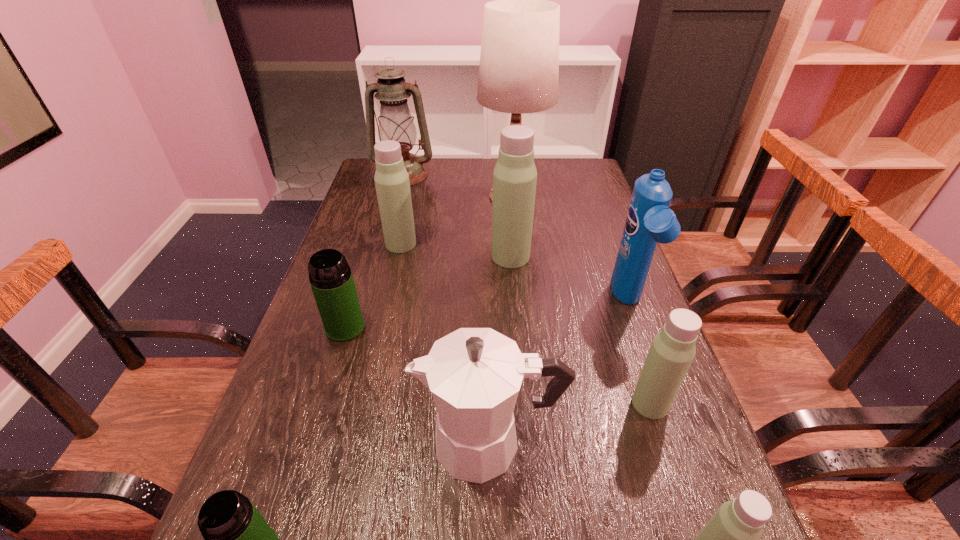
Identify the location of thermos bottle that can be found as the fifth closest to the tallest thermos bottle. (237, 539).

Select which thermos bottle is the second closest to the oil lamp. Please provide its 2D coordinates. Your answer should be formatted as a tuple, i.e. [(x, y)], where the tuple contains the x and y coordinates of a point satisfying the conditions above.

[(515, 176)]

Locate an element on the screen. The width and height of the screenshot is (960, 540). light thermos bottle that is the second closest to the shampoo is located at coordinates point(515,176).

Locate which light thermos bottle is the fourth closest to the tallest object. Please provide its 2D coordinates. Your answer should be formatted as a tuple, i.e. [(x, y)], where the tuple contains the x and y coordinates of a point satisfying the conditions above.

[(730, 539)]

Where is `vacant point that satisfies the following two spatial constraints: 1. from the spout of the bigger green thermos bottle; 2. on the left side of the third nearest thermos bottle`? vacant point that satisfies the following two spatial constraints: 1. from the spout of the bigger green thermos bottle; 2. on the left side of the third nearest thermos bottle is located at coordinates (322, 403).